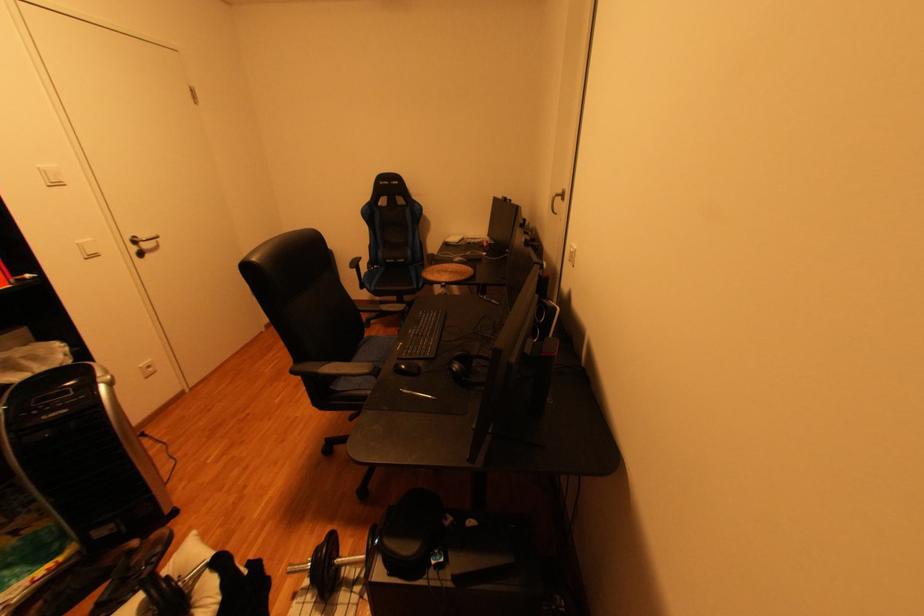
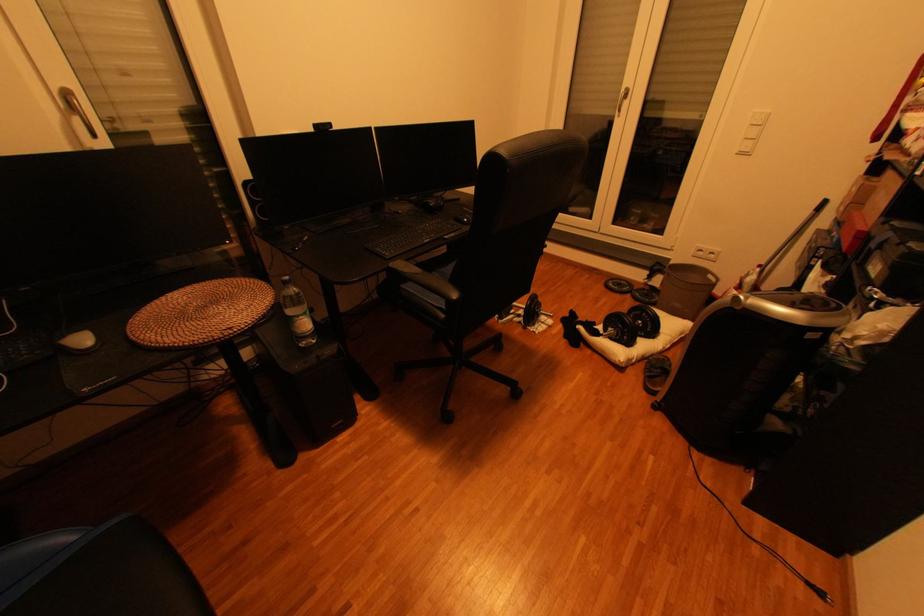
In the second image, find the point that corresponds to point 165,556 in the first image.

(658, 373)